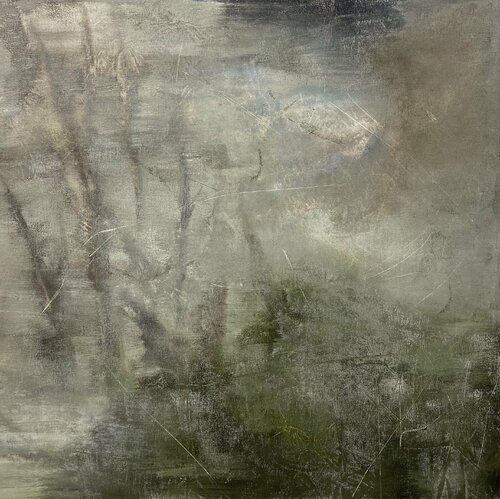
Identify the location of textured painting. Image resolution: width=500 pixels, height=499 pixels. (238, 248).